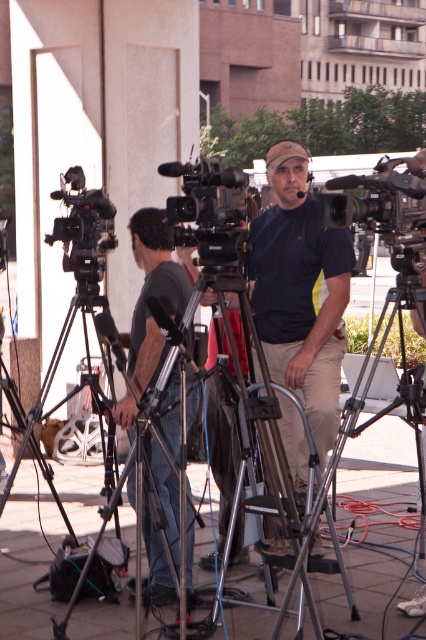
Looking at this image, is silver metallic tripod at center shorter than black plastic camera at center?

Incorrect, silver metallic tripod at center's height does not fall short of black plastic camera at center's.

Is silver metallic tripod at center below black plastic camera at center?

Correct, silver metallic tripod at center is located below black plastic camera at center.

Is point (236, 356) less distant than point (175, 236)?

Yes, point (236, 356) is in front of point (175, 236).

The width and height of the screenshot is (426, 640). Find the location of `silver metallic tripod at center`. silver metallic tripod at center is located at coordinates (247, 387).

Is matte blue shirt at center taller than black matte camera at center?

Incorrect, matte blue shirt at center's height is not larger of black matte camera at center's.

Is matte blue shirt at center positioned in front of black matte camera at center?

No, it is behind black matte camera at center.

Who is more forward, (298, 300) or (393, 221)?

Positioned in front is point (393, 221).

Locate an element on the screen. This screenshot has height=640, width=426. matte blue shirt at center is located at coordinates (301, 292).

Does dark gray fabric shirt at center appear on the left side of black matte camera at center?

Yes, dark gray fabric shirt at center is to the left of black matte camera at center.

Who is more forward, (141, 305) or (377, 193)?

Point (377, 193) is in front.

Where is `dark gray fabric shirt at center`? The height and width of the screenshot is (640, 426). dark gray fabric shirt at center is located at coordinates (152, 294).